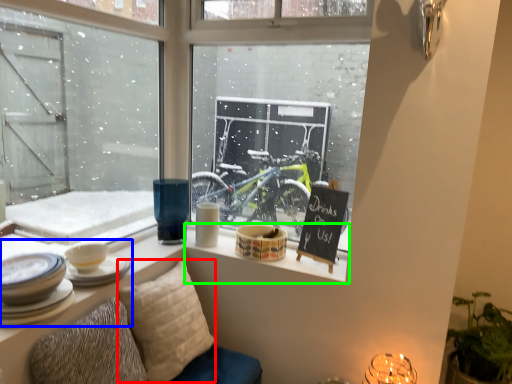
Question: Based on their relative distances, which object is farther from pillow (highlighted by a red box)? Choose from tableware (highlighted by a blue box) and window sill (highlighted by a green box).

Choices:
 (A) tableware
 (B) window sill

Answer: (A)